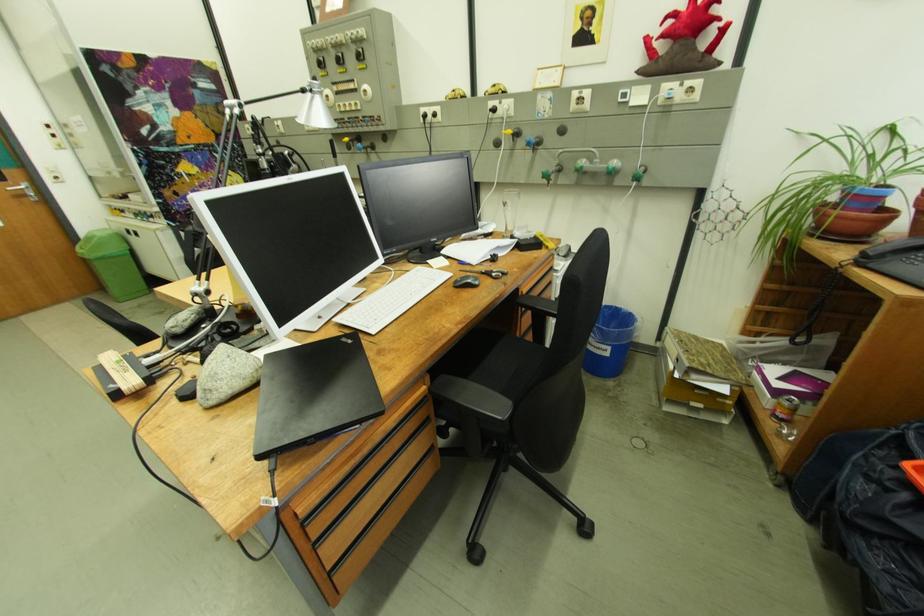
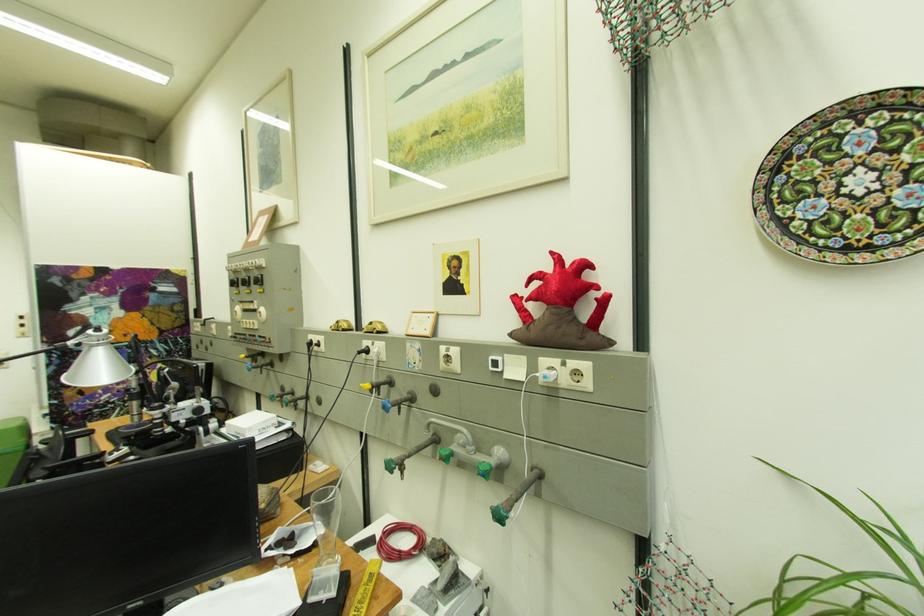
Locate, in the second image, the point that corresponds to point 501,232 in the first image.

(320, 545)